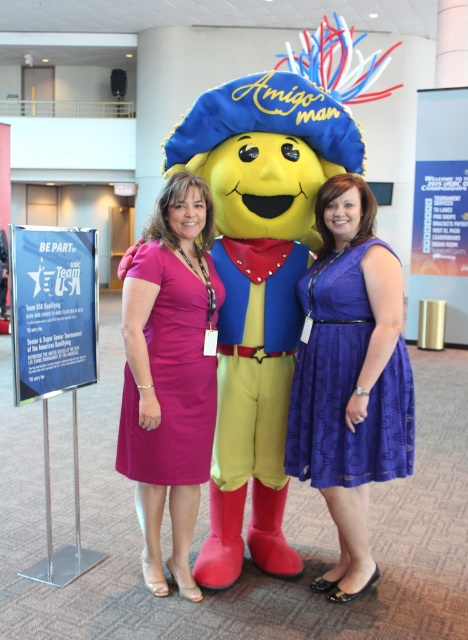
You are a photographer at the event and need to adjust the lighting for both the purple lace dress at center and the pink satin dress at center. Since one is much taller than the other, which dress will require the light to be raised higher?

The purple lace dress at center is much taller than the pink satin dress at center, so the light should be raised higher for the purple lace dress at center.

Looking at this image, you are a photographer at the event and need to arrange the two women in the image so that their dresses are visible. The woman in the purple lace dress at center and the woman in the pink satin dress at center are currently overlapping. Which dress should you move to the left to ensure both are fully visible?

The purple lace dress at center is positioned on the right side of the pink satin dress at center. To ensure both dresses are fully visible, move the purple lace dress at center to the left so it no longer overlaps with the pink satin dress at center.